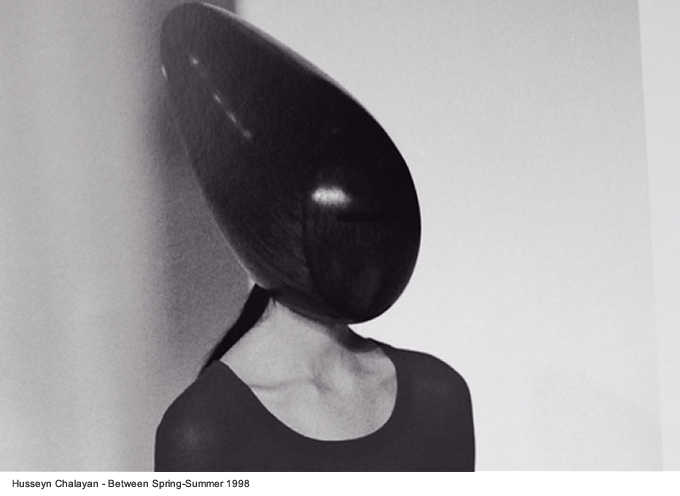
Where is `wall`? This screenshot has width=680, height=496. wall is located at coordinates (490, 108), (124, 203).